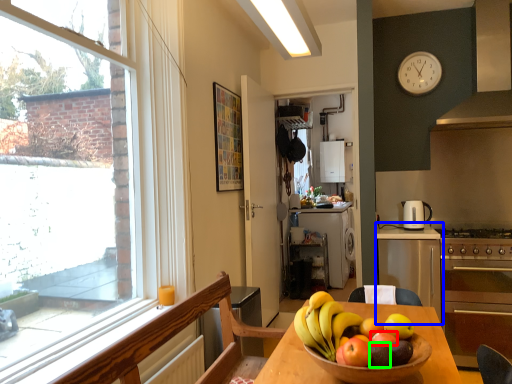
Question: Estimate the real-world distances between objects in this image. Which object is closer to apple (highlighted by a red box), cabinetry (highlighted by a blue box) or apple (highlighted by a green box)?

Choices:
 (A) cabinetry
 (B) apple

Answer: (B)